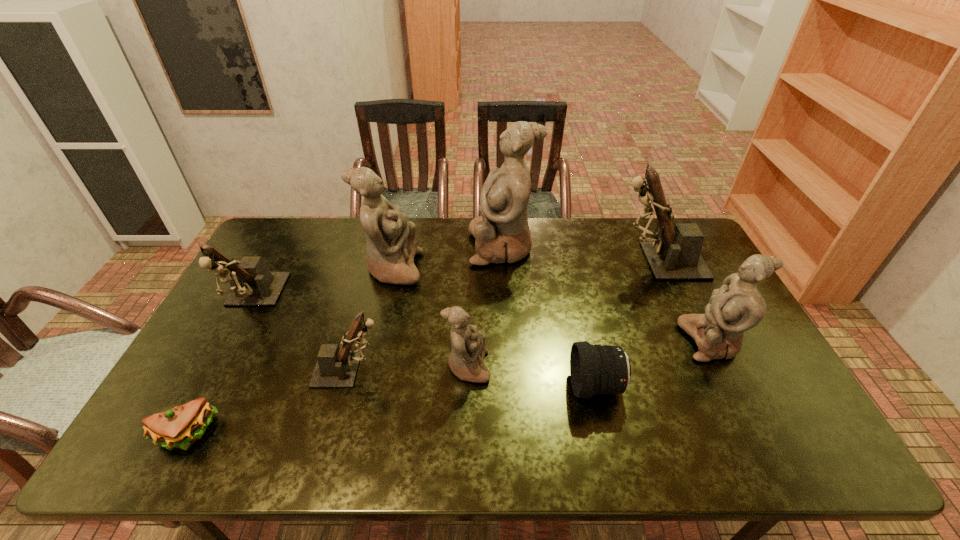
In the image, there is a desktop. At what (x,y) coordinates should I click in order to perform the action: click on vacant space at the far left corner. Please return your answer as a coordinate pair (x, y). Looking at the image, I should click on (300, 224).

Where is `vacant region at the near left corner`? This screenshot has height=540, width=960. vacant region at the near left corner is located at coordinates (156, 456).

Locate an element on the screen. free space between the second brown figurine from left to right and the second smallest brown figurine is located at coordinates (301, 335).

The image size is (960, 540). Find the location of `free point between the rightmost brown figurine and the sandwich`. free point between the rightmost brown figurine and the sandwich is located at coordinates (421, 348).

Identify the location of unoccupied area between the rightmost brown figurine and the leftmost figurine. The image size is (960, 540). (455, 281).

At what (x,y) coordinates should I click in order to perform the action: click on free area in between the black telephoto lens and the nearest object. Please return your answer as a coordinate pair (x, y). Looking at the image, I should click on (392, 410).

You are a GUI agent. You are given a task and a screenshot of the screen. Output one action in this format:
    pyautogui.click(x=<x>, y=<y>)
    Task: Click on the empty space between the rightmost brown figurine and the sandwich
    Image resolution: width=960 pixels, height=540 pixels.
    Given the screenshot: What is the action you would take?
    pyautogui.click(x=421, y=348)

Locate an element on the screen. The width and height of the screenshot is (960, 540). vacant space that is in between the black telephoto lens and the tallest object is located at coordinates (549, 316).

Locate an element on the screen. vacant space that's between the second brown figurine from left to right and the tallest figurine is located at coordinates (426, 308).

What are the coordinates of `free space that is in between the second brown figurine from right to left and the rightmost white figurine` in the screenshot? It's located at (531, 355).